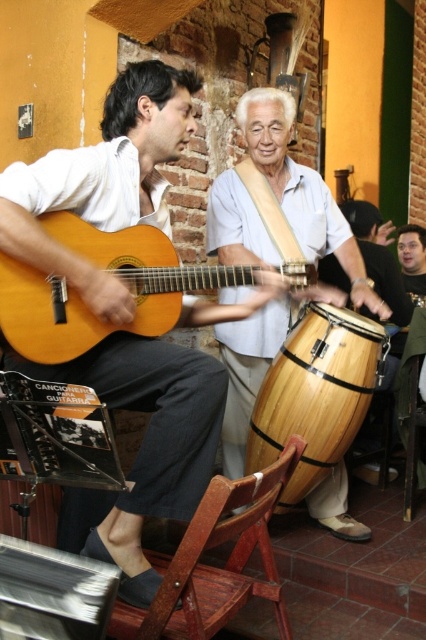
Question: Which point is farther from the camera taking this photo?

Choices:
 (A) (339, 276)
 (B) (294, 368)

Answer: (A)

Question: Can you confirm if natural wood drum at center is positioned to the right of wooden drum at center?

Choices:
 (A) yes
 (B) no

Answer: (B)

Question: Can you confirm if matte wood guitar at left is thinner than natural wood drum at center?

Choices:
 (A) yes
 (B) no

Answer: (A)

Question: Which point is farther to the camera?

Choices:
 (A) matte wood guitar at center
 (B) natural wood drum at lower center
 (C) matte wood guitar at left
 (D) wooden drum at center

Answer: (D)

Question: Observing the image, what is the correct spatial positioning of matte wood guitar at left in reference to wooden drum at center?

Choices:
 (A) left
 (B) right

Answer: (A)

Question: Which point is farther to the camera?

Choices:
 (A) matte wood guitar at left
 (B) natural wood drum at lower center

Answer: (B)